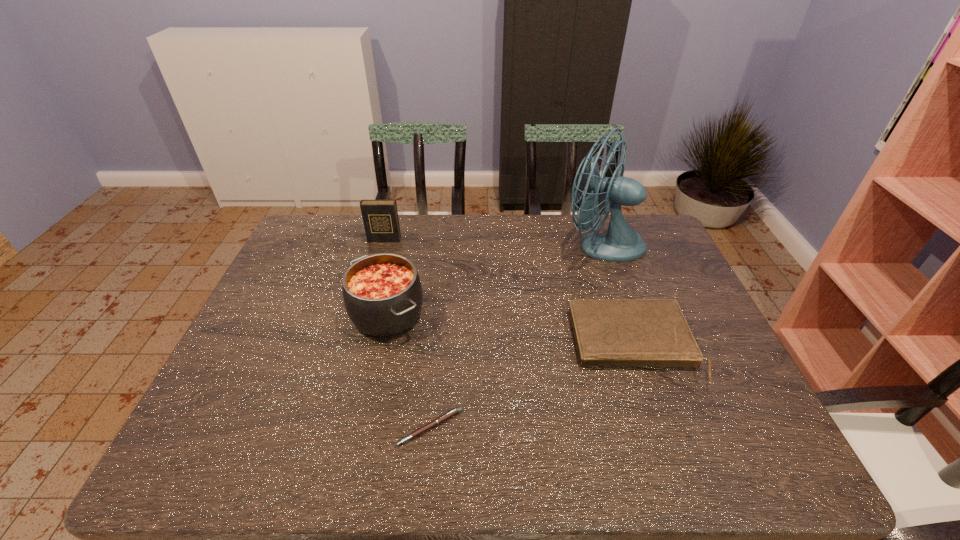
Locate an element on the screen. free space located on the left of the casserole is located at coordinates (256, 314).

Find the location of a particular element. This screenshot has width=960, height=540. vacant space located on the spine side of the paperback book is located at coordinates (672, 460).

The width and height of the screenshot is (960, 540). Find the location of `fan positioned at the far edge`. fan positioned at the far edge is located at coordinates (621, 243).

This screenshot has height=540, width=960. Identify the location of diary that is at the far edge. (380, 217).

Where is `object that is at the near edge`? Image resolution: width=960 pixels, height=540 pixels. object that is at the near edge is located at coordinates (448, 415).

The image size is (960, 540). Identify the location of fan present at the right edge. coord(621,243).

Where is `paperback book positioned at the right edge`? This screenshot has height=540, width=960. paperback book positioned at the right edge is located at coordinates (647, 333).

Identify the location of object located at the far right corner. Image resolution: width=960 pixels, height=540 pixels. (621, 243).

In the image, there is a desktop. At what (x,y) coordinates should I click in order to perform the action: click on vacant area at the far edge. Please return your answer as a coordinate pair (x, y). Looking at the image, I should click on (561, 217).

Find the location of a particular element. The image size is (960, 540). free space at the near edge is located at coordinates (354, 471).